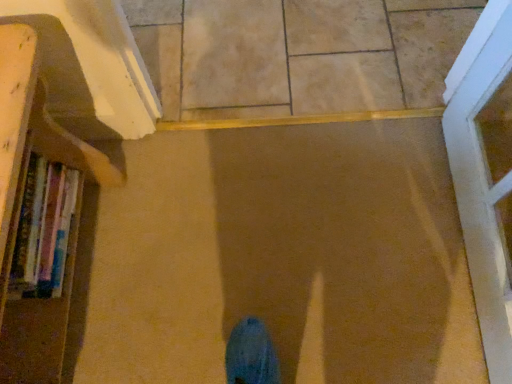
The width and height of the screenshot is (512, 384). What are the coordinates of `hardcover books at left` in the screenshot? It's located at (44, 231).

The image size is (512, 384). Describe the element at coordinates (44, 231) in the screenshot. I see `hardcover books at left` at that location.

At what (x,y) coordinates should I click in order to perform the action: click on wooden bookshelf at left. Please return your answer as a coordinate pair (x, y). Looking at the image, I should click on (37, 215).

In order to face wooden bookshelf at left, should I rotate leftwards or rightwards?

A 31.476 degree turn to the left will do.

At what (x,y) coordinates should I click in order to perform the action: click on hardcover books at left. Please return your answer as a coordinate pair (x, y). This screenshot has height=384, width=512. Looking at the image, I should click on (44, 231).

Considering their positions, is wooden bookshelf at left located in front of or behind hardcover books at left?

wooden bookshelf at left is positioned closer to the viewer than hardcover books at left.

Does point (38, 344) lie in front of point (57, 213)?

Yes, it is in front of point (57, 213).

Is wooden bookshelf at left not inside hardcover books at left?

wooden bookshelf at left lies outside hardcover books at left's area.

Could you tell me if wooden bookshelf at left is turned towards hardcover books at left?

Yes, wooden bookshelf at left is oriented towards hardcover books at left.

Can you confirm if hardcover books at left is thinner than wooden bookshelf at left?

Yes.

Consider the image. Is the surface of hardcover books at left in direct contact with wooden bookshelf at left?

Yes, hardcover books at left is next to wooden bookshelf at left.

Could you tell me if hardcover books at left is facing wooden bookshelf at left?

Yes, hardcover books at left is oriented towards wooden bookshelf at left.

Who is shorter, hardcover books at left or wooden bookshelf at left?

hardcover books at left is shorter.

Looking at this image, which of these two, beige tile at center or wooden bookshelf at left, is bigger?

wooden bookshelf at left.

Does beige tile at center contain wooden bookshelf at left?

No, wooden bookshelf at left is located outside of beige tile at center.

Which is more to the left, beige tile at center or wooden bookshelf at left?

wooden bookshelf at left.

Considering the relative sizes of beige tile at center and wooden bookshelf at left in the image provided, is beige tile at center wider than wooden bookshelf at left?

Indeed, beige tile at center has a greater width compared to wooden bookshelf at left.

From a real-world perspective, between wooden bookshelf at left and beige tile at center, who is vertically higher?

wooden bookshelf at left.

Can you see wooden bookshelf at left touching beige tile at center?

No, wooden bookshelf at left is not touching beige tile at center.

Which object is positioned more to the right, wooden bookshelf at left or beige tile at center?

beige tile at center.

From the image's perspective, is beige tile at center located beneath hardcover books at left?

No, from the image's perspective, beige tile at center is not below hardcover books at left.

What's the angular difference between beige tile at center and hardcover books at left's facing directions?

90 degrees.

Are beige tile at center and hardcover books at left far apart?

No, beige tile at center is not far away from hardcover books at left.

Between beige tile at center and hardcover books at left, which one is positioned behind?

beige tile at center is further away from the camera.

Which object is positioned more to the left, hardcover books at left or beige tile at center?

hardcover books at left.

In terms of height, does hardcover books at left look taller or shorter compared to beige tile at center?

In the image, hardcover books at left appears to be taller than beige tile at center.

Is hardcover books at left further to the viewer compared to beige tile at center?

No, hardcover books at left is in front of beige tile at center.

In order to click on tile located above the hardcover books at left (from the image's perspective) in this screenshot , I will do `click(298, 54)`.

At what (x,y) coordinates should I click in order to perform the action: click on book that appears below the wooden bookshelf at left (from a real-world perspective). Please return your answer as a coordinate pair (x, y). The height and width of the screenshot is (384, 512). Looking at the image, I should click on (44, 231).

This screenshot has height=384, width=512. Identify the location of bookcase located in front of the hardcover books at left. (37, 215).

When comparing their distances from wooden bookshelf at left, does beige tile at center or hardcover books at left seem further?

beige tile at center is further to wooden bookshelf at left.

Considering their positions, is wooden bookshelf at left positioned further to beige tile at center than hardcover books at left?

hardcover books at left lies further to beige tile at center than the other object.

Looking at the image, which one is located closer to beige tile at center, hardcover books at left or wooden bookshelf at left?

wooden bookshelf at left is positioned closer to the anchor beige tile at center.

Based on their spatial positions, is beige tile at center or wooden bookshelf at left closer to hardcover books at left?

wooden bookshelf at left.

Which object lies nearer to the anchor point hardcover books at left, wooden bookshelf at left or beige tile at center?

wooden bookshelf at left.

Estimate the real-world distances between objects in this image. Which object is closer to wooden bookshelf at left, hardcover books at left or beige tile at center?

hardcover books at left is closer to wooden bookshelf at left.

At what (x,y) coordinates should I click in order to perform the action: click on book between wooden bookshelf at left and beige tile at center in the horizontal direction. Please return your answer as a coordinate pair (x, y). The image size is (512, 384). Looking at the image, I should click on (44, 231).